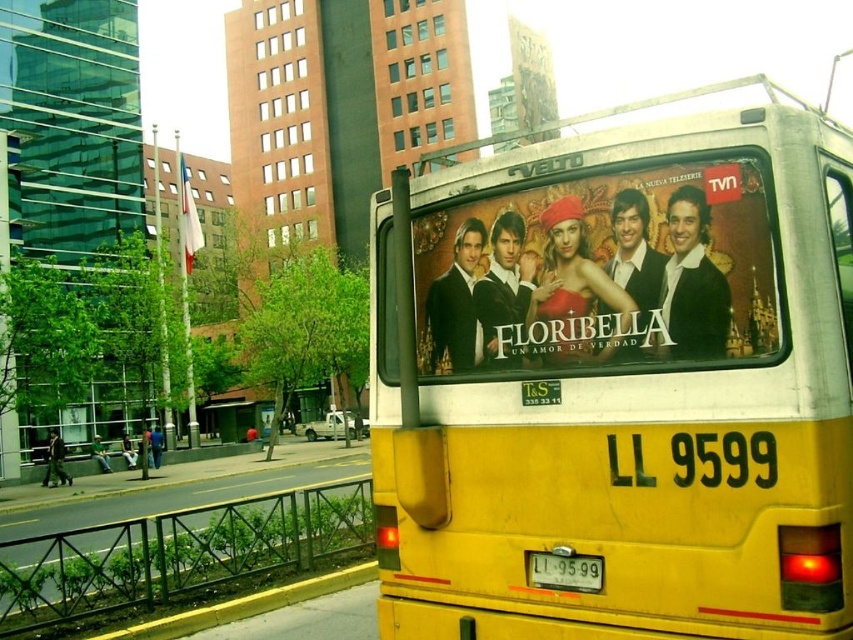
You are a delivery person needing to park a 3.5m wide van between the yellow matte bus at center and the matte black poster at center. Can you fit your van there?

The yellow matte bus at center might be wider than matte black poster at center, so there is uncertainty about the available space. It is possible the van may not fit if the bus is indeed wider, but without exact measurements, it is hard to determine.

You are standing in the middle of the sidewalk in the urban scene. There is a matte black poster at center. If you want to read the text on the poster, will you be able to see the details clearly from your current position?

The matte black poster at center is 3.26 meters away from the viewer. Since the average comfortable reading distance for most people is around 30 cm to 1 meter, the poster is too far away for the viewer to see the details clearly without moving closer.